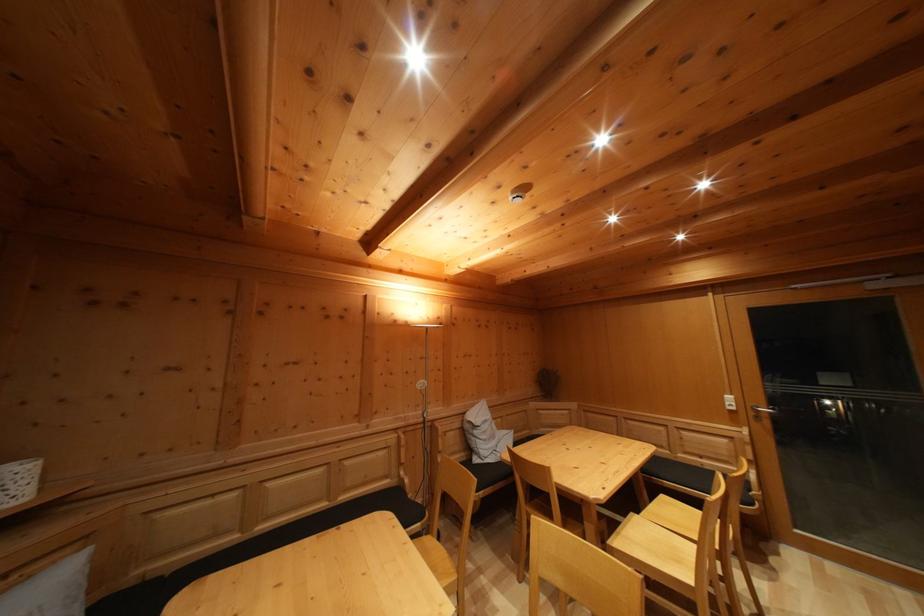
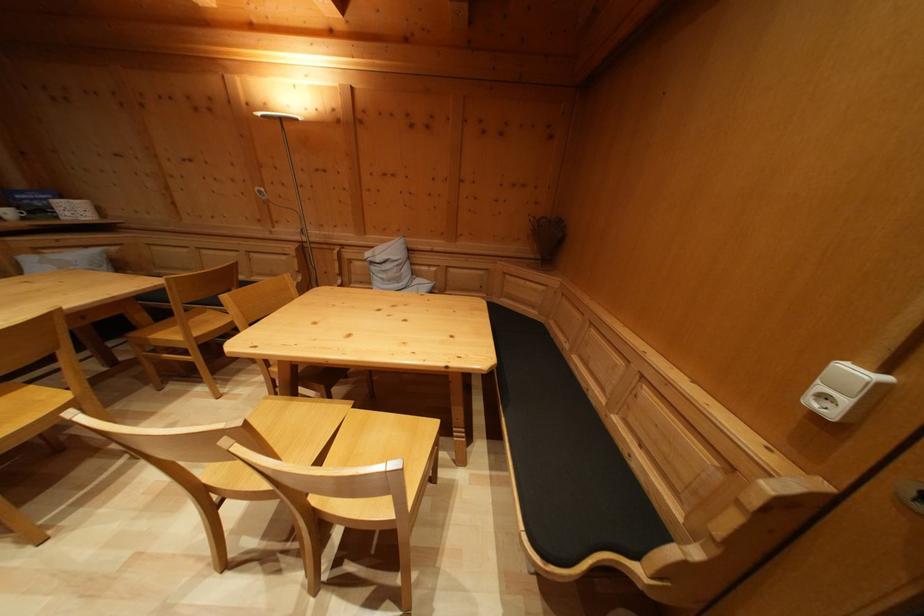
Find the pixel in the second image that matches [736,405] in the first image.

(859, 379)